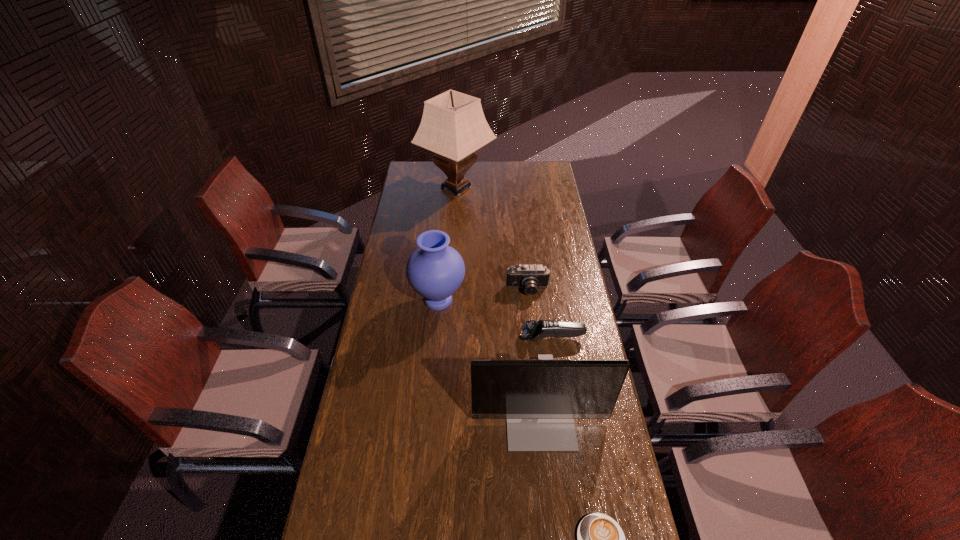
In order to click on the tallest object in this screenshot , I will do `click(453, 125)`.

The width and height of the screenshot is (960, 540). Identify the location of lampshade. (453, 125).

The height and width of the screenshot is (540, 960). Find the location of `vase`. vase is located at coordinates (435, 270).

This screenshot has height=540, width=960. Find the location of `the fifth farthest object`. the fifth farthest object is located at coordinates (540, 399).

At what (x,y) coordinates should I click in order to perform the action: click on camera. Please return your answer as a coordinate pair (x, y). Looking at the image, I should click on (530, 277).

The image size is (960, 540). Find the location of `the fifth tallest object`. the fifth tallest object is located at coordinates (532, 330).

Where is `electric shaver`? electric shaver is located at coordinates (532, 330).

Where is `vacant area situated 0.310m on the right of the tallest object`? Image resolution: width=960 pixels, height=540 pixels. vacant area situated 0.310m on the right of the tallest object is located at coordinates (553, 187).

The height and width of the screenshot is (540, 960). In order to click on vacant area located on the front of the vase in this screenshot , I will do `click(429, 402)`.

Locate an element on the screen. free space located on the screen of the computer monitor is located at coordinates (551, 524).